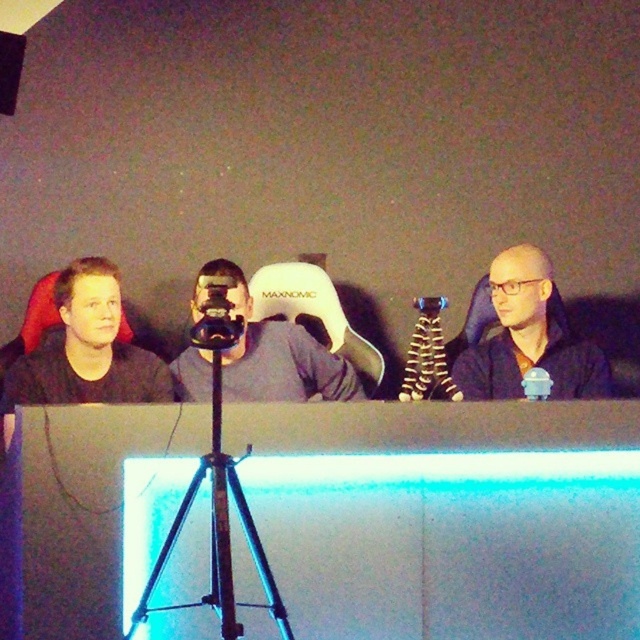
Which is behind, point (504, 252) or point (196, 276)?

Point (504, 252)

Between point (509, 259) and point (259, 342), which one is positioned behind?

Point (259, 342)

Locate an element on the screen. black matte jacket at center is located at coordinates [529, 337].

Between black matte jacket at center and black plastic camera at center, which one appears on the left side from the viewer's perspective?

black plastic camera at center is more to the left.

Does black matte jacket at center appear on the left side of black plastic camera at center?

Incorrect, black matte jacket at center is not on the left side of black plastic camera at center.

This screenshot has height=640, width=640. Find the location of `black matte jacket at center`. black matte jacket at center is located at coordinates (529, 337).

Does matte gray chair at center appear on the right side of black plastic camera at center?

Indeed, matte gray chair at center is positioned on the right side of black plastic camera at center.

Does matte gray chair at center have a greater width compared to black plastic camera at center?

Correct, the width of matte gray chair at center exceeds that of black plastic camera at center.

Is point (321, 376) behind point (227, 336)?

Yes, point (321, 376) is behind point (227, 336).

Where is `matte gray chair at center`? matte gray chair at center is located at coordinates (284, 365).